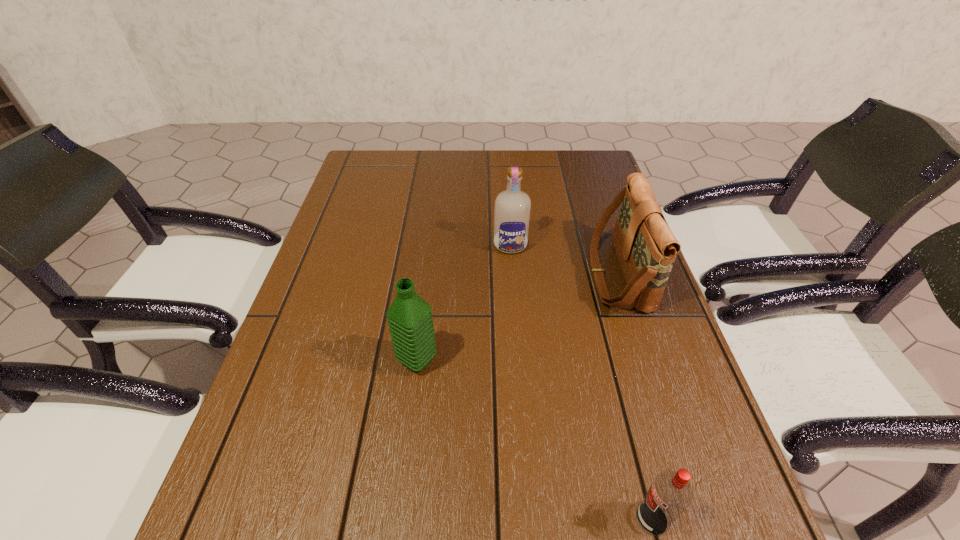
What are the coordinates of `the left vodka` in the screenshot? It's located at (512, 208).

Where is `the second object from left to right`? The width and height of the screenshot is (960, 540). the second object from left to right is located at coordinates (512, 208).

At what (x,y) coordinates should I click in order to perform the action: click on water bottle. Please return your answer as a coordinate pair (x, y). The height and width of the screenshot is (540, 960). Looking at the image, I should click on (410, 320).

Where is `the leftmost object`? The width and height of the screenshot is (960, 540). the leftmost object is located at coordinates (410, 320).

Where is `shoulder bag`? The width and height of the screenshot is (960, 540). shoulder bag is located at coordinates (646, 248).

Image resolution: width=960 pixels, height=540 pixels. In order to click on the nearest object in this screenshot , I will do `click(670, 494)`.

Identify the location of the shortest object. (670, 494).

In order to click on blank area located 0.230m on the label of the second object from left to right in this screenshot , I will do `click(516, 323)`.

I want to click on free space located on the back of the leftmost object, so click(422, 320).

The image size is (960, 540). I want to click on vacant position located 0.090m on the front-facing side of the shoulder bag, so [x=556, y=274].